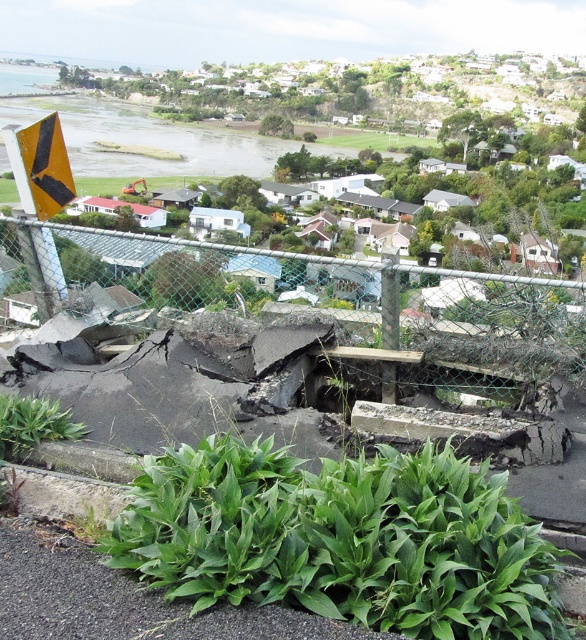
Question: Which of the following is the closest to the observer?

Choices:
 (A) yellow matte triangle at upper left
 (B) green leafy plant at lower center

Answer: (B)

Question: Does green leafy plant at lower center appear over wire mesh fence at center?

Choices:
 (A) no
 (B) yes

Answer: (A)

Question: Which point appears closest to the camera in this image?

Choices:
 (A) (43, 144)
 (B) (234, 452)
 (C) (308, 321)

Answer: (B)

Question: Does green leafy plant at lower center appear over yellow matte triangle at upper left?

Choices:
 (A) no
 (B) yes

Answer: (A)

Question: Is green leafy plant at lower center above yellow matte triangle at upper left?

Choices:
 (A) yes
 (B) no

Answer: (B)

Question: Which point appears farthest from the camera in this image?

Choices:
 (A) (512, 621)
 (B) (180, 250)

Answer: (B)